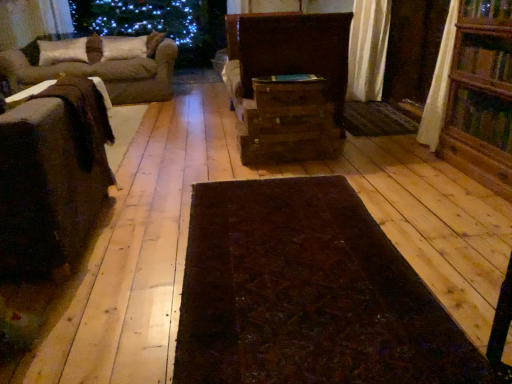
Locate an element on the screen. Image resolution: width=512 pixels, height=384 pixels. vacant area situated to the left side of wooden bookshelf at right is located at coordinates (404, 179).